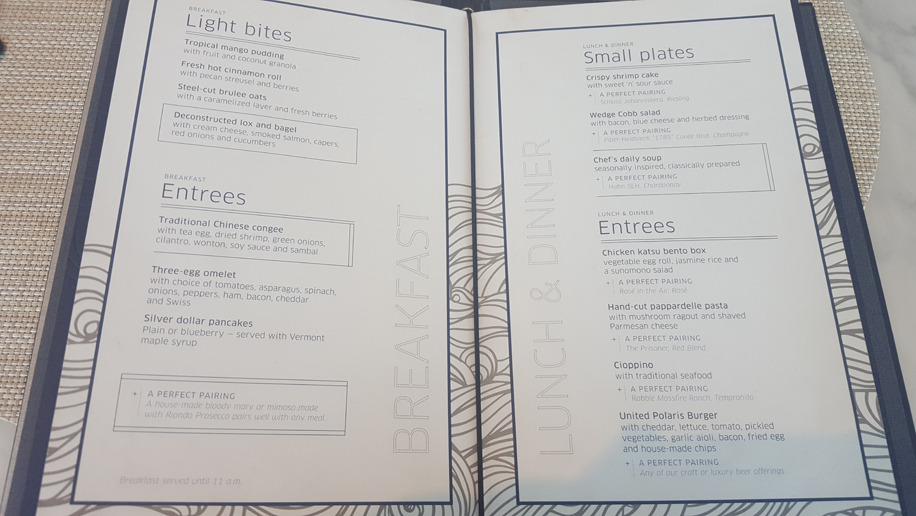
At what (x,y) coordinates should I click in order to perform the action: click on placemat. Please return your answer as a coordinate pair (x, y). Looking at the image, I should click on (56, 101), (853, 73).